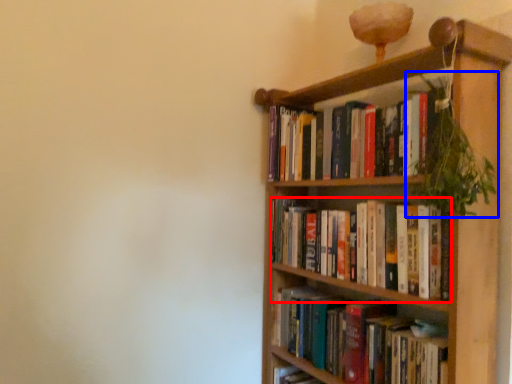
Question: Which of the following is the farthest to the observer, book (highlighted by a red box) or vegetation (highlighted by a blue box)?

Choices:
 (A) book
 (B) vegetation

Answer: (A)